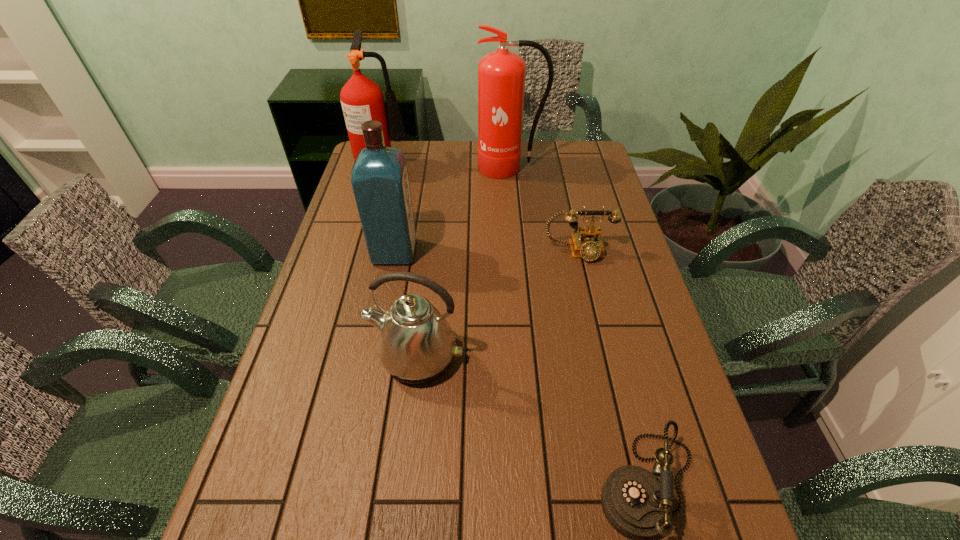
This screenshot has height=540, width=960. Identify the location of the right fire extinguisher. (501, 74).

Image resolution: width=960 pixels, height=540 pixels. I want to click on the left fire extinguisher, so click(362, 100).

At what (x,y) coordinates should I click in order to perform the action: click on liquor. Please return your answer as a coordinate pair (x, y). Looking at the image, I should click on (379, 178).

Where is `the second nearest object`? the second nearest object is located at coordinates (416, 345).

This screenshot has width=960, height=540. In order to click on the third shortest object in this screenshot , I will do `click(416, 345)`.

You are a GUI agent. You are given a task and a screenshot of the screen. Output one action in this format:
    pyautogui.click(x=<x>, y=<y>)
    Task: Click on the farther telephone
    The width and height of the screenshot is (960, 540).
    Given the screenshot: What is the action you would take?
    pyautogui.click(x=587, y=243)

The height and width of the screenshot is (540, 960). I want to click on blank space located 0.280m towards the nozzle of the right fire extinguisher, so click(x=516, y=229).

Image resolution: width=960 pixels, height=540 pixels. I want to click on vacant area situated 0.320m at the nozzle of the left fire extinguisher, so click(x=496, y=165).

Locate an element on the screen. free space located on the flat label side of the liquor is located at coordinates (535, 252).

Identify the location of blank space located on the back of the kettle. (429, 251).